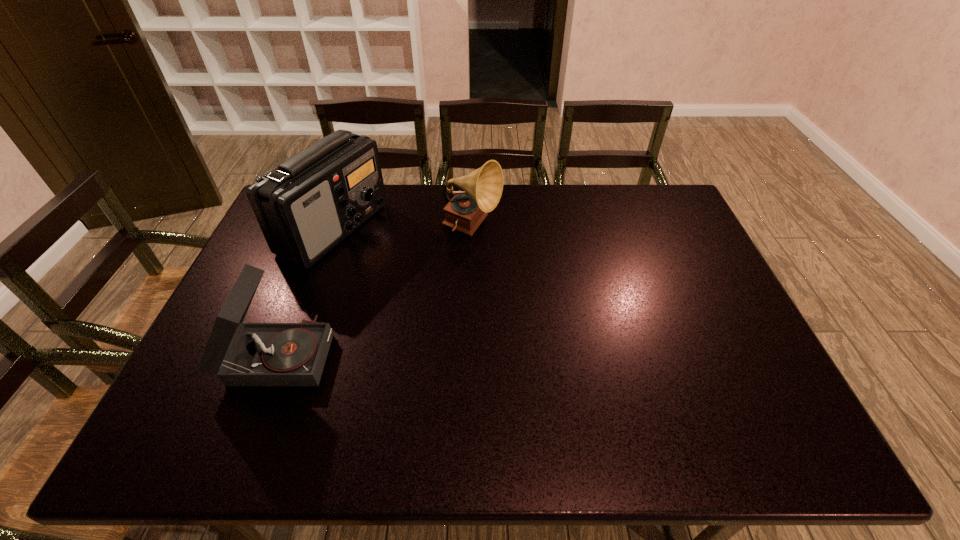
This screenshot has height=540, width=960. I want to click on radio receiver situated at the left edge, so click(307, 205).

The width and height of the screenshot is (960, 540). I want to click on phonograph_record located at the left edge, so click(x=241, y=354).

Locate an element on the screen. This screenshot has height=540, width=960. object at the far left corner is located at coordinates (307, 205).

The image size is (960, 540). Identify the location of vacant space at the far edge of the desktop. (519, 193).

In the image, there is a desktop. What are the coordinates of `free space at the near edge` in the screenshot? It's located at (660, 427).

In the image, there is a desktop. At what (x,y) coordinates should I click in order to perform the action: click on vacant space at the left edge. Please return your answer as a coordinate pair (x, y). The height and width of the screenshot is (540, 960). Looking at the image, I should click on (209, 374).

Where is `free spot at the right edge of the desktop`? The image size is (960, 540). free spot at the right edge of the desktop is located at coordinates (665, 259).

This screenshot has width=960, height=540. I want to click on free space between the rightmost object and the nearest object, so click(x=375, y=291).

Locate an element on the screen. The height and width of the screenshot is (540, 960). free space that is in between the radio receiver and the nearest object is located at coordinates (306, 291).

Locate an element on the screen. The height and width of the screenshot is (540, 960). vacant space that is in between the right phonograph_record and the radio receiver is located at coordinates (403, 229).